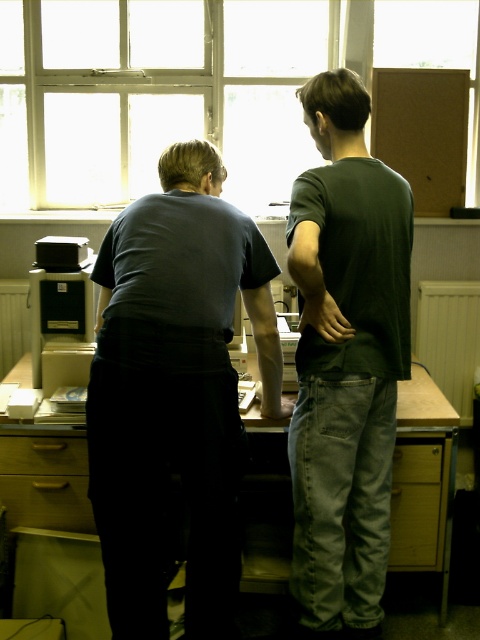
You are standing in the office and want to approach the wooden desk at center. Which side of the dark gray shirt at center should you go around to reach the desk?

You should go around the right side of the dark gray shirt at center to reach the wooden desk at center since the dark gray shirt at center is to the left of the desk.

You are a photographer setting up a shot in this office. You need to ensure that the dark gray shirt at center and the wooden desk at center are both visible in the frame. Given their sizes, which object will appear larger in the photo?

The dark gray shirt at center is much taller than the wooden desk at center, so it will appear larger in the photo.